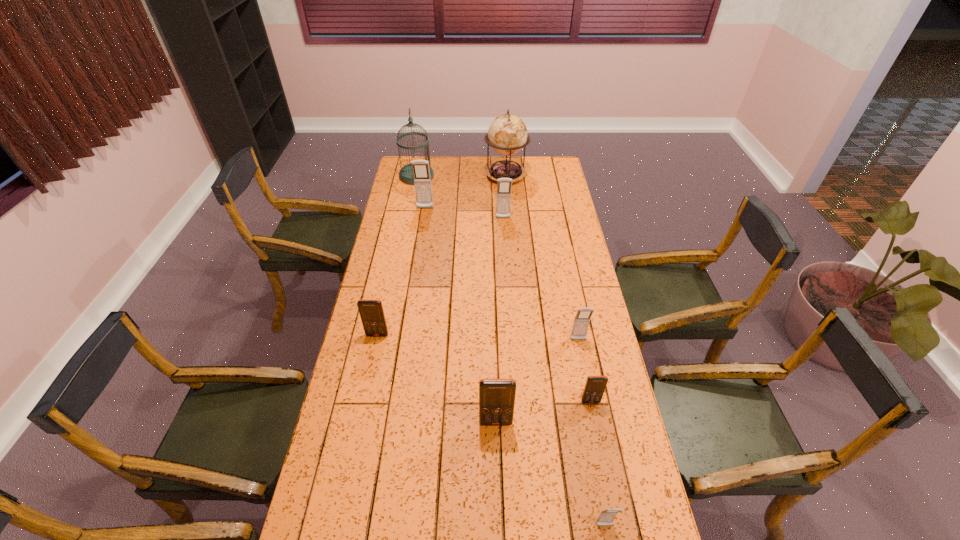
Where is `free space between the third biggest gray cellular telephone and the globe`? The image size is (960, 540). free space between the third biggest gray cellular telephone and the globe is located at coordinates tap(542, 258).

The height and width of the screenshot is (540, 960). I want to click on unoccupied position between the globe and the birdcage, so click(x=461, y=176).

The image size is (960, 540). What are the coordinates of `free space between the farthest gray cellular telephone and the smallest orange cellular telephone` in the screenshot? It's located at (508, 305).

The height and width of the screenshot is (540, 960). I want to click on empty space that is in between the globe and the second smallest orange cellular telephone, so click(x=442, y=256).

Where is `blank region between the second smallest orange cellular telephone and the second nearest orange cellular telephone`? blank region between the second smallest orange cellular telephone and the second nearest orange cellular telephone is located at coordinates (484, 368).

Locate an element on the screen. This screenshot has height=540, width=960. vacant point located between the birdcage and the second nearest gray cellular telephone is located at coordinates coord(497,258).

At what (x,y) coordinates should I click in order to perform the action: click on vacant region between the leftmost cellular telephone and the third farthest gray cellular telephone. Please return your answer as a coordinate pair (x, y). The width and height of the screenshot is (960, 540). Looking at the image, I should click on 478,338.

Find the location of a particular element. The width and height of the screenshot is (960, 540). free spot between the smallest orange cellular telephone and the nearest object is located at coordinates (597, 463).

Where is `free area in between the third nearest object and the leftmost cellular telephone`? free area in between the third nearest object and the leftmost cellular telephone is located at coordinates (484, 368).

The width and height of the screenshot is (960, 540). In order to click on object that ranks as the seventh closest to the second farthest gray cellular telephone in this screenshot , I will do `click(496, 396)`.